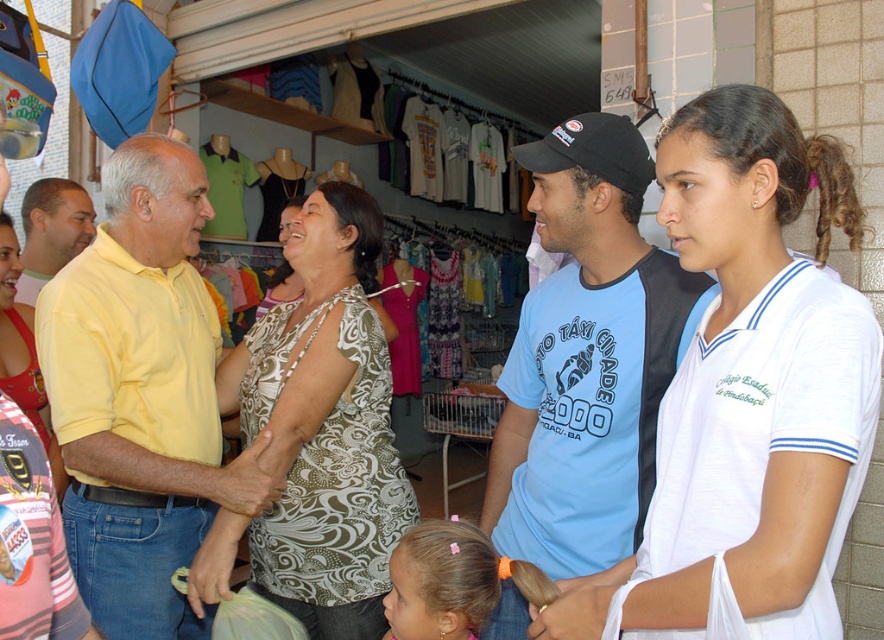
Question: Which object is closer to the camera taking this photo?

Choices:
 (A) blonde hair at lower center
 (B) blue t-shirt at center
 (C) printed fabric blouse at center
 (D) white cotton shirt at center

Answer: (D)

Question: Which of the following is the farthest from the observer?

Choices:
 (A) (488, 556)
 (B) (89, 211)

Answer: (B)

Question: Is yellow cotton shirt at center smaller than blue t-shirt at center?

Choices:
 (A) yes
 (B) no

Answer: (B)

Question: Does yellow cotton shirt at center lie in front of blue t-shirt at center?

Choices:
 (A) yes
 (B) no

Answer: (B)

Question: Is blonde hair at lower center below yellow matte shirt at left?

Choices:
 (A) yes
 (B) no

Answer: (A)

Question: Which is nearer to the yellow matte shirt at left?

Choices:
 (A) white cotton shirt at center
 (B) blue t-shirt at center
 (C) yellow cotton shirt at center

Answer: (C)